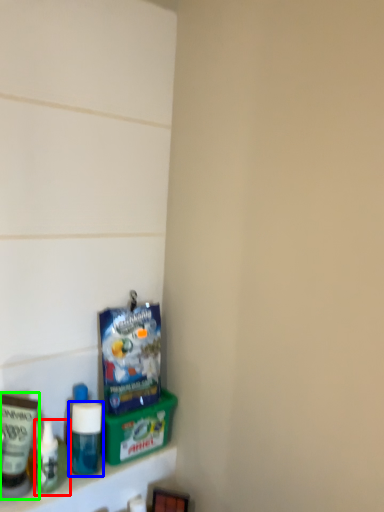
Question: Considering the real-world distances, which object is farthest from toiletry (highlighted by a red box)? bottle (highlighted by a blue box) or toiletry (highlighted by a green box)?

Choices:
 (A) bottle
 (B) toiletry

Answer: (A)